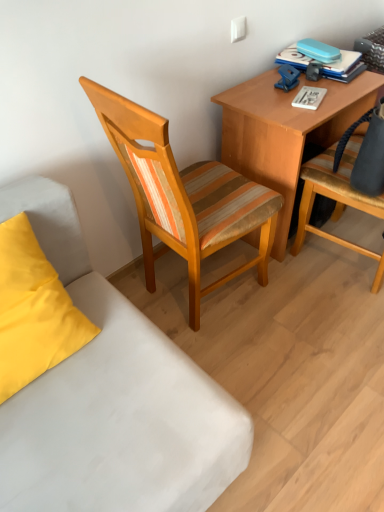
Find the location of a particular element. This screenshot has width=384, height=512. vacant space underneath woodenchair at center, the first chair when ordered from left to right (from a real-world perspective) is located at coordinates (201, 296).